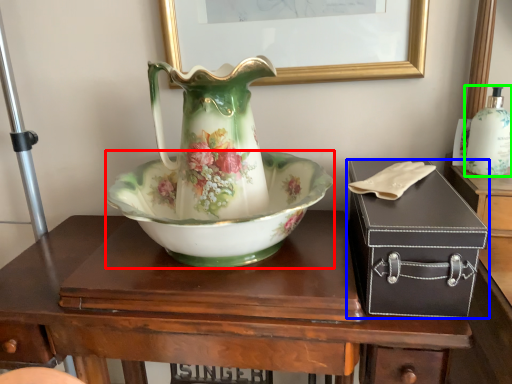
Question: Estimate the real-world distances between objects in this image. Which object is closer to bowl (highlighted by a red box), box (highlighted by a blue box) or bottle (highlighted by a green box)?

Choices:
 (A) box
 (B) bottle

Answer: (A)